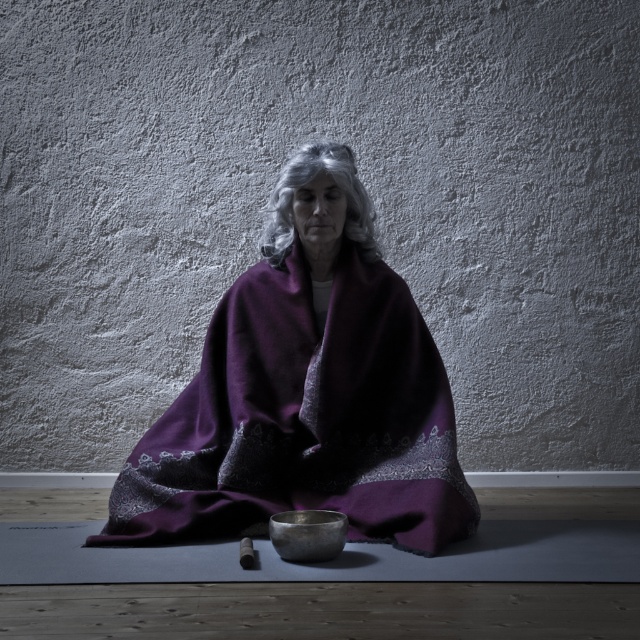
Question: Which point appears farthest from the camera in this image?

Choices:
 (A) (326, 518)
 (B) (340, 468)
 (C) (326, 145)

Answer: (B)

Question: Among these objects, which one is farthest from the camera?

Choices:
 (A) shiny metallic bowl at center
 (B) grayhair at center

Answer: (B)

Question: Is purple woolen shawl at center positioned behind grayhair at center?

Choices:
 (A) no
 (B) yes

Answer: (A)

Question: Considering the relative positions of purple woolen shawl at center and grayhair at center in the image provided, where is purple woolen shawl at center located with respect to grayhair at center?

Choices:
 (A) left
 (B) right

Answer: (A)

Question: Among these objects, which one is nearest to the camera?

Choices:
 (A) purple woolen shawl at center
 (B) grayhair at center

Answer: (A)

Question: Does grayhair at center appear on the right side of shiny metallic bowl at center?

Choices:
 (A) no
 (B) yes

Answer: (B)